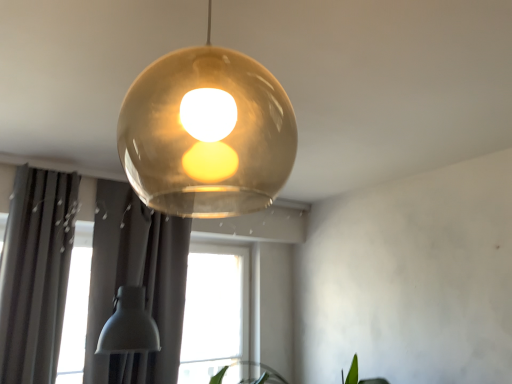
Question: Is green leafy plant at lower right behind dark gray fabric curtain at left, arranged as the 1th curtain when viewed from the left?

Choices:
 (A) no
 (B) yes

Answer: (B)

Question: Considering the relative sizes of green leafy plant at lower right and dark gray fabric curtain at left, marked as the 2th curtain in a right-to-left arrangement, in the image provided, is green leafy plant at lower right wider than dark gray fabric curtain at left, marked as the 2th curtain in a right-to-left arrangement,?

Choices:
 (A) yes
 (B) no

Answer: (A)

Question: Is green leafy plant at lower right aimed at dark gray fabric curtain at left, marked as the 2th curtain in a right-to-left arrangement?

Choices:
 (A) no
 (B) yes

Answer: (A)

Question: Is green leafy plant at lower right in contact with dark gray fabric curtain at left, marked as the 2th curtain in a right-to-left arrangement?

Choices:
 (A) yes
 (B) no

Answer: (B)

Question: Is green leafy plant at lower right thinner than dark gray fabric curtain at left, arranged as the 1th curtain when viewed from the left?

Choices:
 (A) no
 (B) yes

Answer: (A)

Question: Is green leafy plant at lower right not close to dark gray fabric curtain at left, arranged as the 1th curtain when viewed from the left?

Choices:
 (A) no
 (B) yes

Answer: (B)

Question: Would you say green leafy plant at lower right is outside translucent amber sphere at center?

Choices:
 (A) yes
 (B) no

Answer: (A)

Question: Is green leafy plant at lower right oriented away from translucent amber sphere at center?

Choices:
 (A) no
 (B) yes

Answer: (A)

Question: Can you confirm if green leafy plant at lower right is taller than translucent amber sphere at center?

Choices:
 (A) no
 (B) yes

Answer: (A)

Question: Can you confirm if green leafy plant at lower right is smaller than translucent amber sphere at center?

Choices:
 (A) no
 (B) yes

Answer: (A)

Question: Does green leafy plant at lower right turn towards translucent amber sphere at center?

Choices:
 (A) no
 (B) yes

Answer: (A)

Question: Can you confirm if green leafy plant at lower right is wider than translucent amber sphere at center?

Choices:
 (A) yes
 (B) no

Answer: (A)

Question: Does matte gray curtain at lower left, the 2th curtain from the left, have a greater width compared to translucent amber sphere at center?

Choices:
 (A) no
 (B) yes

Answer: (A)